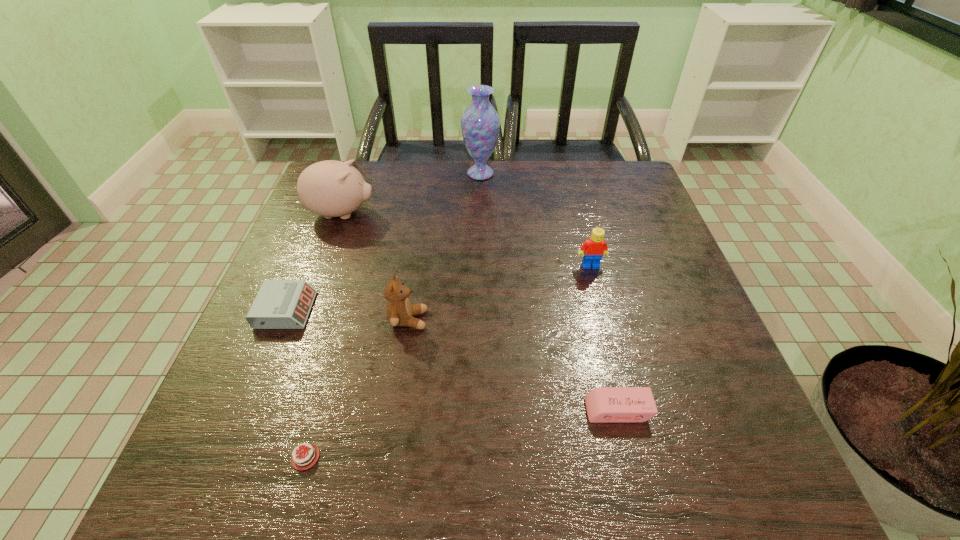
Find the location of a particular element. vacant area located on the right of the farthest object is located at coordinates (593, 174).

Where is `free spot located 0.400m at the snout of the piggy bank`? This screenshot has height=540, width=960. free spot located 0.400m at the snout of the piggy bank is located at coordinates (527, 214).

What are the coordinates of `vacant region located on the front-facing side of the fourth object from left to right` in the screenshot? It's located at (475, 320).

Where is `vacant region located 0.180m on the face of the Lego`? This screenshot has width=960, height=540. vacant region located 0.180m on the face of the Lego is located at coordinates (608, 332).

Image resolution: width=960 pixels, height=540 pixels. I want to click on free spot located 0.370m on the right of the alarm clock, so click(486, 310).

Where is `vacant space located on the left of the eraser`? vacant space located on the left of the eraser is located at coordinates (438, 410).

Where is `vacant space located 0.130m on the right of the nearest object`? vacant space located 0.130m on the right of the nearest object is located at coordinates (421, 457).

Where is `vase that is at the far edge`? The image size is (960, 540). vase that is at the far edge is located at coordinates (480, 123).

Locate an element on the screen. The width and height of the screenshot is (960, 540). piggy bank that is positioned at the far edge is located at coordinates (330, 188).

Identify the location of object that is at the near edge. (309, 453).